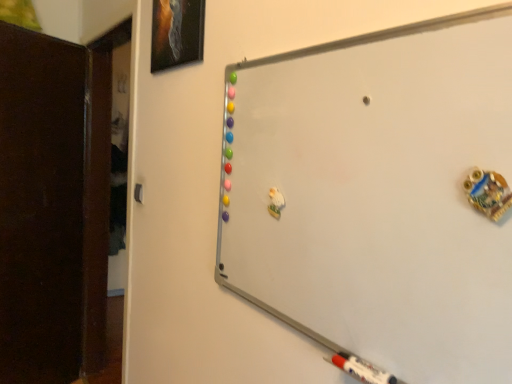
Question: From a real-world perspective, relative to matte black picture frame at upper left, is dark wood door at left vertically above or below?

Choices:
 (A) below
 (B) above

Answer: (A)

Question: In the image, is dark wood door at left on the left side or the right side of matte black picture frame at upper left?

Choices:
 (A) right
 (B) left

Answer: (B)

Question: Estimate the real-world distances between objects in this image. Which object is farther from the matte black picture frame at upper left?

Choices:
 (A) whiteboard at upper right
 (B) dark wood door at left

Answer: (B)

Question: Estimate the real-world distances between objects in this image. Which object is farther from the dark wood door at left?

Choices:
 (A) whiteboard at upper right
 (B) matte black picture frame at upper left

Answer: (A)